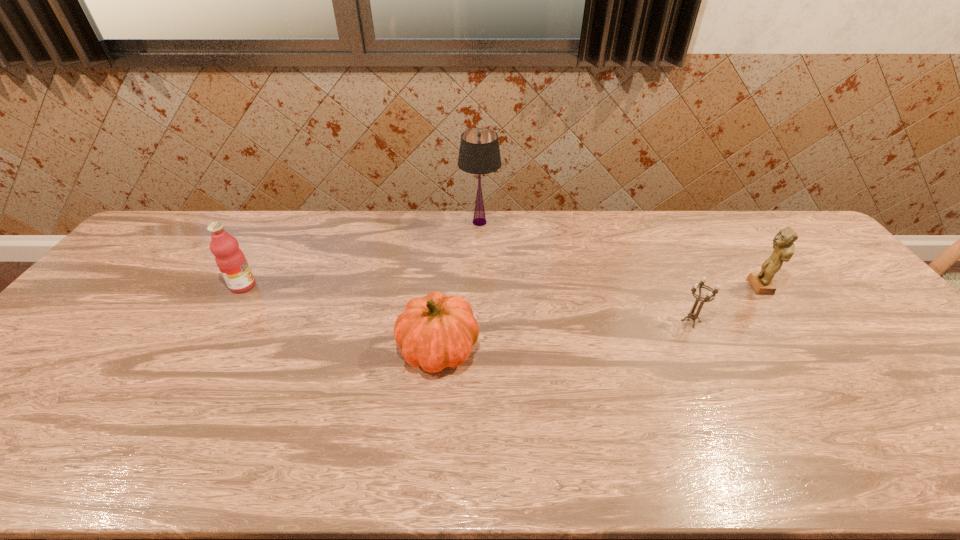
Identify the location of the farthest object. coord(479,153).

Locate an element on the screen. The image size is (960, 540). the tallest object is located at coordinates (479, 153).

Locate an element on the screen. The width and height of the screenshot is (960, 540). fruit juice is located at coordinates (231, 261).

Identify the location of figurine. (783, 244).

Where is `the second shortest object`? The height and width of the screenshot is (540, 960). the second shortest object is located at coordinates (437, 331).

Identify the location of the second object from right to left. This screenshot has width=960, height=540. (708, 298).

Locate an element on the screen. candle holder is located at coordinates (708, 298).

The height and width of the screenshot is (540, 960). I want to click on vacant space located 0.230m on the front-facing side of the farthest object, so click(x=564, y=222).

Identify the location of free space located on the label of the fruit juice. This screenshot has height=540, width=960. coord(333,286).

Where is `vacant area situated 0.260m on the front-facing side of the rightmost object`? This screenshot has height=540, width=960. vacant area situated 0.260m on the front-facing side of the rightmost object is located at coordinates (660, 287).